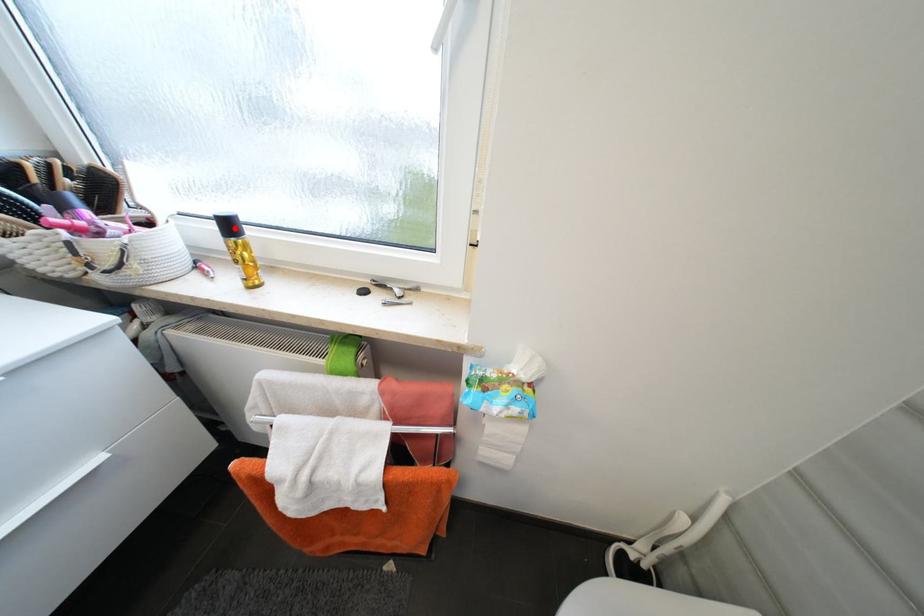
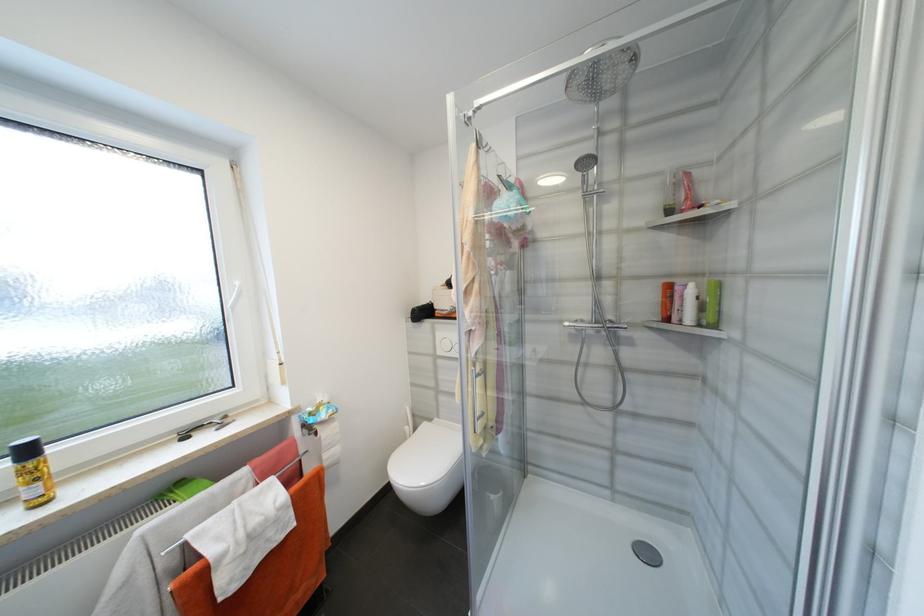
Locate, in the second image, the point that corresponds to the highlighted location in the first image.

(33, 453)